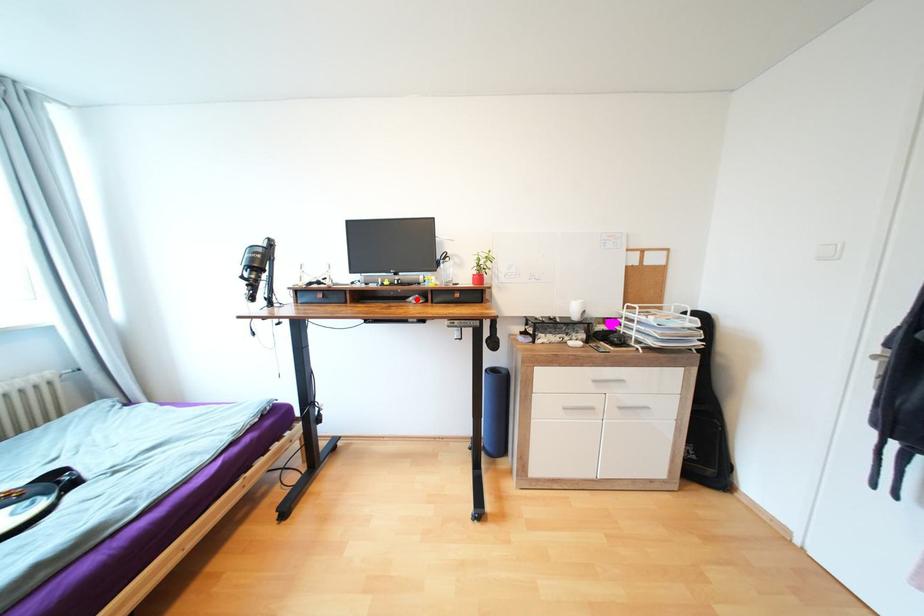
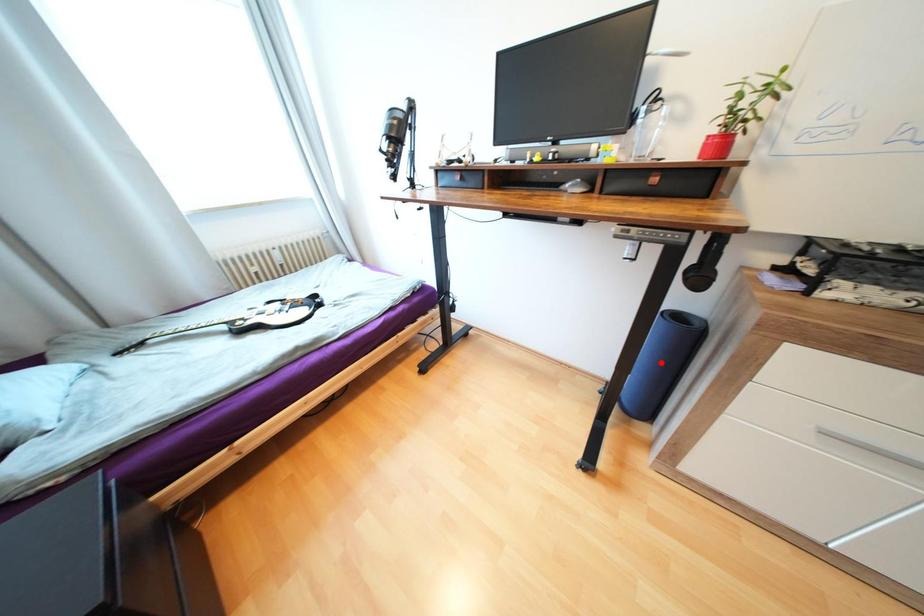
I am providing you with two images of the same scene from different viewpoints. A red point is marked on the first image and another point is marked on the second image. Is the red point in image1 aligned with the point shown in image2?

No